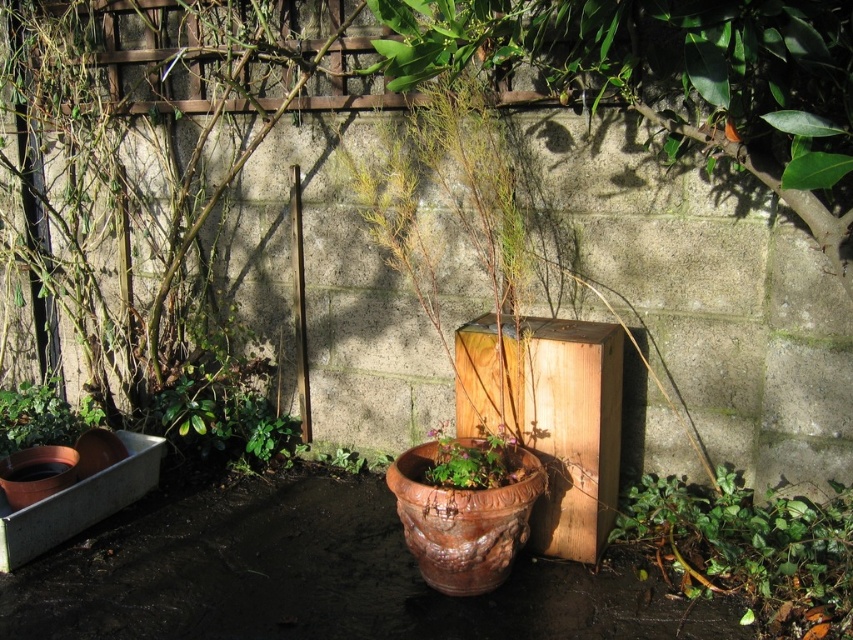
Question: Which object is closer to the camera taking this photo?

Choices:
 (A) matte brown pot at lower left
 (B) green leafy plant at lower right

Answer: (B)

Question: Is green leafy plant at lower right to the right of matte brown pot at lower left from the viewer's perspective?

Choices:
 (A) yes
 (B) no

Answer: (A)

Question: Among these points, which one is nearest to the camera?

Choices:
 (A) (448, 452)
 (B) (48, 422)

Answer: (A)

Question: Among these points, which one is nearest to the camera?

Choices:
 (A) (471, 477)
 (B) (42, 404)

Answer: (A)

Question: Is green leafy plant at lower right bigger than terracotta pot at center?

Choices:
 (A) no
 (B) yes

Answer: (B)

Question: Is matte brown pot at lower left positioned in front of terracotta pot at center?

Choices:
 (A) yes
 (B) no

Answer: (B)